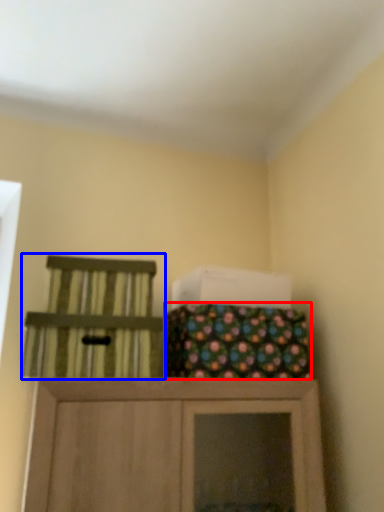
Question: Which point is further to the camera, material (highlighted by a red box) or chair (highlighted by a blue box)?

Choices:
 (A) material
 (B) chair

Answer: (A)